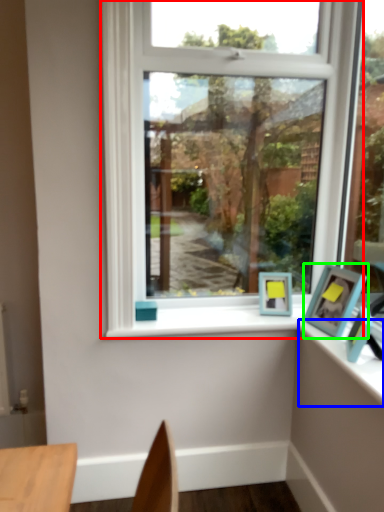
Question: Considering the real-world distances, which object is closest to window (highlighted by a red box)? counter top (highlighted by a blue box) or picture frame (highlighted by a green box).

Choices:
 (A) counter top
 (B) picture frame

Answer: (B)